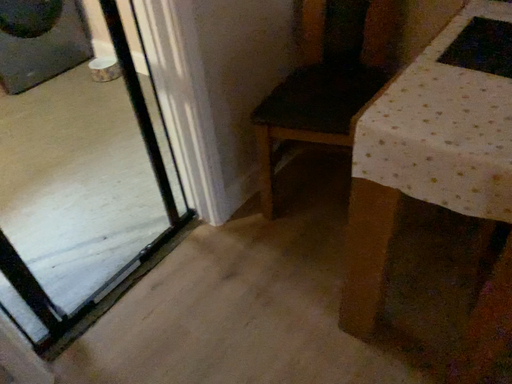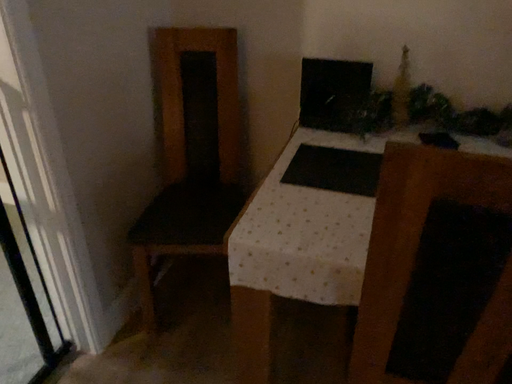
Question: How did the camera likely rotate when shooting the video?

Choices:
 (A) rotated right
 (B) rotated left

Answer: (A)